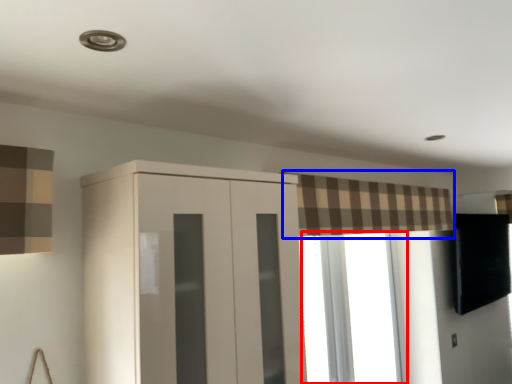
Question: Which object appears farthest to the camera in this image, window (highlighted by a red box) or curtain (highlighted by a blue box)?

Choices:
 (A) window
 (B) curtain

Answer: (A)